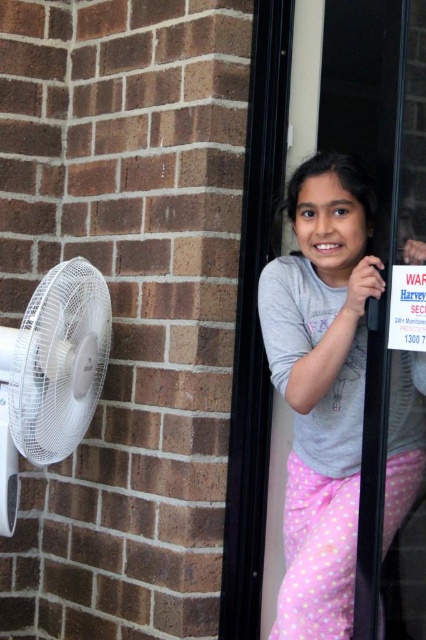
Which is below, gray cotton shirt at upper right or white paper sign at upper right?

gray cotton shirt at upper right is lower down.

Is gray cotton shirt at upper right further to the viewer compared to white paper sign at upper right?

Yes, it is.

Who is more distant from viewer, (325, 241) or (423, 296)?

The point (325, 241) is more distant.

Locate an element on the screen. The width and height of the screenshot is (426, 640). gray cotton shirt at upper right is located at coordinates (321, 387).

Who is shorter, white plastic fan at left or white paper sign at upper right?

Standing shorter between the two is white paper sign at upper right.

Is point (52, 284) positioned after point (417, 339)?

Yes.

This screenshot has width=426, height=640. What do you see at coordinates (51, 372) in the screenshot?
I see `white plastic fan at left` at bounding box center [51, 372].

Image resolution: width=426 pixels, height=640 pixels. In order to click on white plastic fan at left in this screenshot , I will do `click(51, 372)`.

Does gray cotton shirt at upper right have a greater width compared to white plastic fan at left?

Yes.

Is point (353, 195) farther from camera compared to point (83, 308)?

No.

I want to click on gray cotton shirt at upper right, so click(321, 387).

Locate an element on the screen. This screenshot has height=640, width=426. gray cotton shirt at upper right is located at coordinates (321, 387).